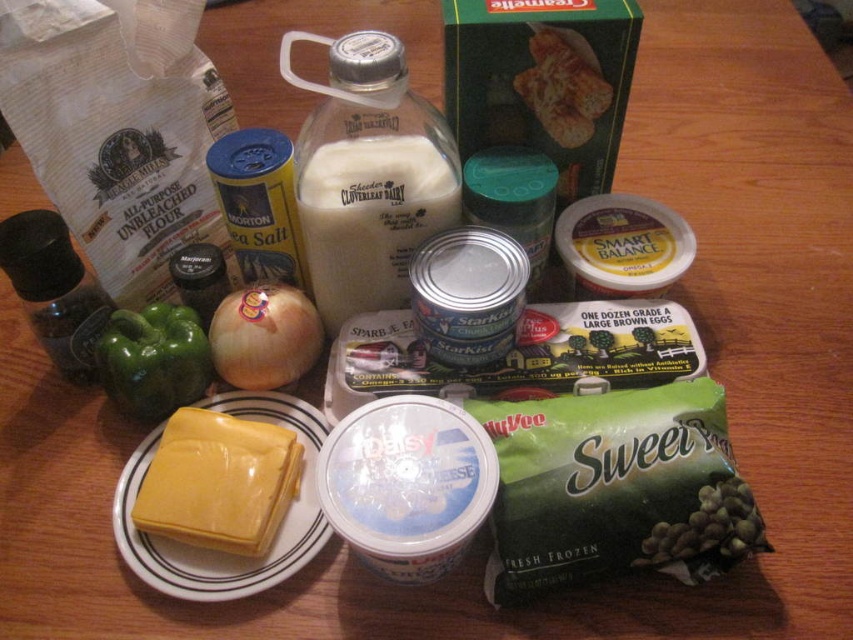
Does point (218, 573) lie behind point (117, 346)?

No.

Where is `yellow cheese at center`? yellow cheese at center is located at coordinates (218, 552).

What do you see at coordinates (370, 218) in the screenshot? The height and width of the screenshot is (640, 853). I see `white opaque bottle at center` at bounding box center [370, 218].

Is white opaque bottle at center closer to the viewer compared to yellow cheese at center?

No, white opaque bottle at center is further to the viewer.

Is point (418, 173) behind point (183, 589)?

Yes, point (418, 173) is farther from viewer.

You are a GUI agent. You are given a task and a screenshot of the screen. Output one action in this format:
    pyautogui.click(x=<x>, y=<y>)
    Task: Click on the white opaque bottle at center
    
    Given the screenshot: What is the action you would take?
    pyautogui.click(x=370, y=218)

What do you see at coordinates (370, 218) in the screenshot?
I see `white opaque bottle at center` at bounding box center [370, 218].

Does point (408, 209) come farther from viewer compared to point (120, 385)?

No, (408, 209) is in front of (120, 385).

Is point (311, 228) positioned after point (135, 321)?

That is True.

The width and height of the screenshot is (853, 640). In order to click on white opaque bottle at center in this screenshot , I will do `click(370, 218)`.